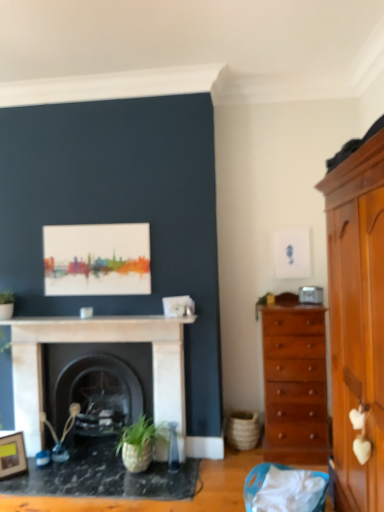
Question: Is white marble fireplace at center placed right next to light brown wooden cabinet at right?

Choices:
 (A) no
 (B) yes

Answer: (A)

Question: Is white marble fireplace at center wider than light brown wooden cabinet at right?

Choices:
 (A) no
 (B) yes

Answer: (A)

Question: Is white marble fireplace at center bigger than light brown wooden cabinet at right?

Choices:
 (A) yes
 (B) no

Answer: (B)

Question: Is white marble fireplace at center positioned far away from light brown wooden cabinet at right?

Choices:
 (A) no
 (B) yes

Answer: (B)

Question: Is light brown wooden cabinet at right inside white marble fireplace at center?

Choices:
 (A) no
 (B) yes

Answer: (A)

Question: Considering the positions of point (104, 433) and point (350, 465), is point (104, 433) closer or farther from the camera than point (350, 465)?

Choices:
 (A) closer
 (B) farther

Answer: (B)

Question: From the image's perspective, relative to light brown wooden cabinet at right, is black marble fireplace at center, the first fireplace from the back, above or below?

Choices:
 (A) below
 (B) above

Answer: (A)

Question: From a real-world perspective, is black marble fireplace at center, the first fireplace from the back, above or below light brown wooden cabinet at right?

Choices:
 (A) below
 (B) above

Answer: (A)

Question: Based on their positions, is black marble fireplace at center, the first fireplace from the back, located to the left or right of light brown wooden cabinet at right?

Choices:
 (A) left
 (B) right

Answer: (A)

Question: Is white marble fireplace at center taller or shorter than shiny brown chest of drawers at right?

Choices:
 (A) short
 (B) tall

Answer: (A)

Question: Considering their positions, is white marble fireplace at center located in front of or behind shiny brown chest of drawers at right?

Choices:
 (A) behind
 (B) front

Answer: (A)

Question: Based on their positions, is white marble fireplace at center located to the left or right of shiny brown chest of drawers at right?

Choices:
 (A) right
 (B) left

Answer: (B)

Question: Is white marble fireplace at center wider or thinner than shiny brown chest of drawers at right?

Choices:
 (A) thin
 (B) wide

Answer: (A)

Question: From the image's perspective, is green matte plant at upper right above or below light brown wooden cabinet at right?

Choices:
 (A) below
 (B) above

Answer: (B)

Question: Is green matte plant at upper right wider or thinner than light brown wooden cabinet at right?

Choices:
 (A) thin
 (B) wide

Answer: (A)